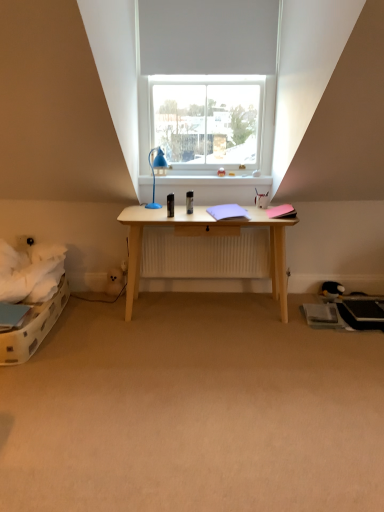
Where is `vacant area on top of beige carpet at center (from a real-world perspective)`? This screenshot has width=384, height=512. vacant area on top of beige carpet at center (from a real-world perspective) is located at coordinates (248, 384).